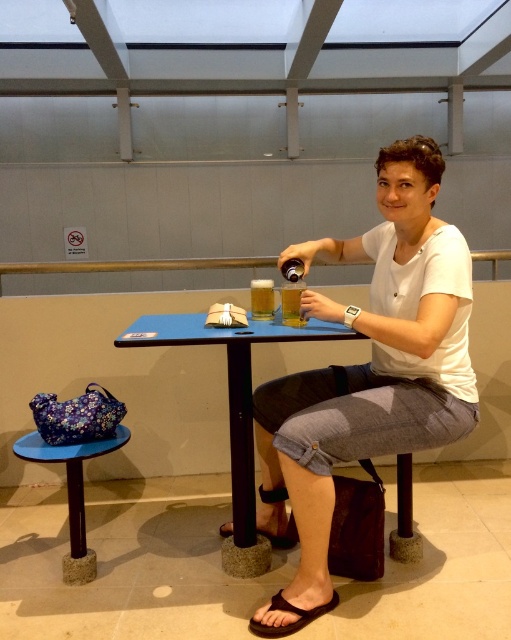
Between blue fabric table at lower left and translucent glass beer at table center, which one has less height?

translucent glass beer at table center is shorter.

Is blue fabric table at lower left bigger than translucent glass beer at table center?

Yes.

The image size is (511, 640). In order to click on blue fabric table at lower left in this screenshot , I will do click(73, 492).

Between blue plastic table at center and translucent glass beer at center, which one appears on the left side from the viewer's perspective?

blue plastic table at center is more to the left.

Looking at this image, can you confirm if blue plastic table at center is positioned above translucent glass beer at center?

No.

Who is more distant from viewer, (228, 365) or (287, 292)?

The point (228, 365) is more distant.

Find the location of a particular element. The image size is (511, 640). blue plastic table at center is located at coordinates (231, 408).

Which is behind, point (290, 595) or point (290, 515)?

The point (290, 515) is more distant.

Does point (371, 403) come farther from viewer compared to point (278, 547)?

No, (371, 403) is closer to viewer.

Is point (446, 224) behind point (272, 541)?

No, (446, 224) is closer to viewer.

Locate an element on the screen. The width and height of the screenshot is (511, 640). white cotton shirt at center is located at coordinates (x=371, y=362).